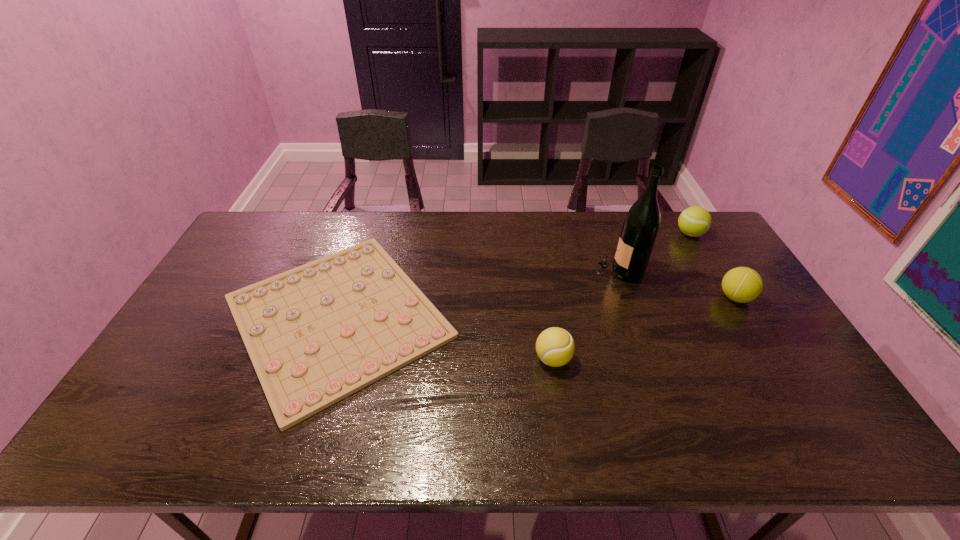
Locate an element on the screen. This screenshot has height=540, width=960. free space located on the front of the second farthest tennis ball is located at coordinates (757, 333).

Image resolution: width=960 pixels, height=540 pixels. Find the location of `blank space located on the back of the second object from left to right`. blank space located on the back of the second object from left to right is located at coordinates (537, 253).

Image resolution: width=960 pixels, height=540 pixels. I want to click on vacant point located on the right of the leftmost object, so click(x=517, y=317).

Find the location of a particular element. This screenshot has width=960, height=540. tennis ball located in the far edge section of the desktop is located at coordinates (694, 221).

The image size is (960, 540). What are the coordinates of `gameboard that is at the far edge` in the screenshot? It's located at (316, 334).

Where is `object at the near edge`? This screenshot has height=540, width=960. object at the near edge is located at coordinates (316, 334).

At what (x,y) coordinates should I click in order to perform the action: click on object present at the left edge. Please return your answer as a coordinate pair (x, y). The height and width of the screenshot is (540, 960). Looking at the image, I should click on (316, 334).

Identify the location of object that is at the far left corner. The height and width of the screenshot is (540, 960). (316, 334).

You are a GUI agent. You are given a task and a screenshot of the screen. Output one action in this format:
    pyautogui.click(x=<x>, y=<y>)
    Task: Click on the object present at the near left corner
    This screenshot has width=960, height=540.
    Given the screenshot: What is the action you would take?
    pyautogui.click(x=316, y=334)

The height and width of the screenshot is (540, 960). I want to click on object situated at the far right corner, so click(x=694, y=221).